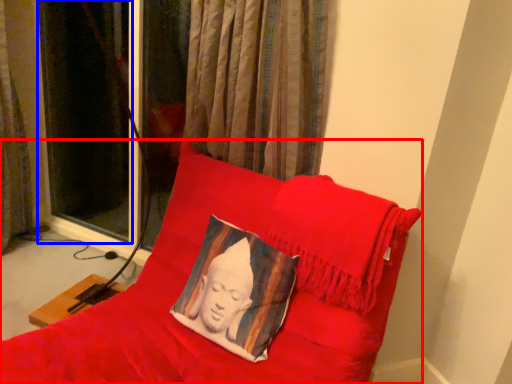
Question: Which object is closer to the camera taking this photo, furniture (highlighted by a red box) or curtain (highlighted by a blue box)?

Choices:
 (A) furniture
 (B) curtain

Answer: (A)